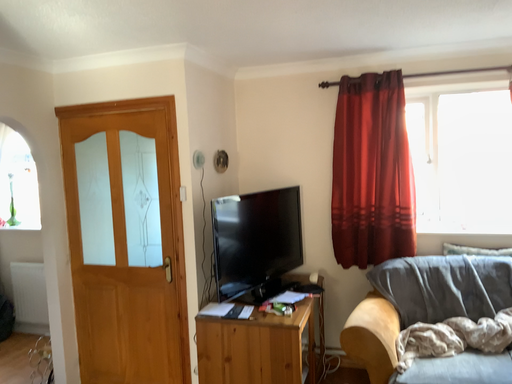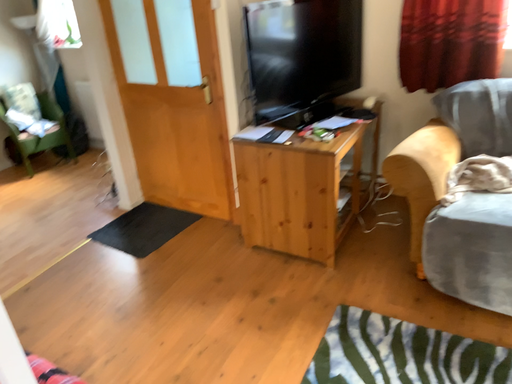
Question: Which way did the camera rotate in the video?

Choices:
 (A) rotated right
 (B) rotated left

Answer: (B)